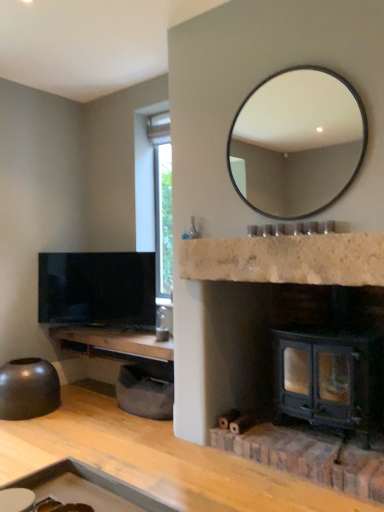
Question: Considering their positions, is matte black tv at left located in front of or behind matte black mirror at upper center?

Choices:
 (A) front
 (B) behind

Answer: (B)

Question: Is matte black tv at left wider or thinner than matte black mirror at upper center?

Choices:
 (A) wide
 (B) thin

Answer: (A)

Question: Which of these objects is positioned farthest from the woodenmaterial/texturecounter top at left, which is the second counter top from right to left?

Choices:
 (A) dark green metal wood burning stove at lower right
 (B) matte black bowl at lower left
 (C) matte black tv at left
 (D) matte black mirror at upper center
 (E) white marble fireplace at center, positioned as the 2th counter top in left-to-right order

Answer: (D)

Question: Estimate the real-world distances between objects in this image. Which object is farther from the matte black tv at left?

Choices:
 (A) dark green metal wood burning stove at lower right
 (B) white marble fireplace at center, the second counter top from the bottom
 (C) matte black mirror at upper center
 (D) woodenmaterial/texturecounter top at left, the first counter top positioned from the bottom
 (E) matte black bowl at lower left

Answer: (C)